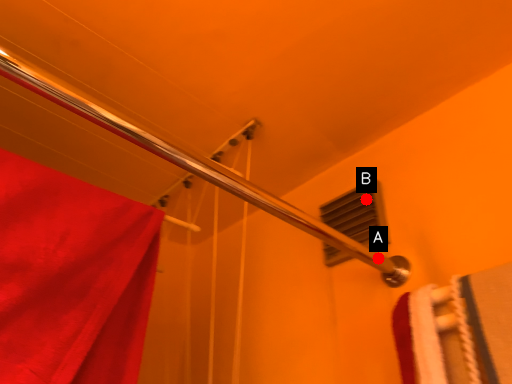
Question: Two points are circled on the image, labeled by A and B beside each circle. Which of the following is the farthest from the observer?

Choices:
 (A) A is further
 (B) B is further

Answer: (B)